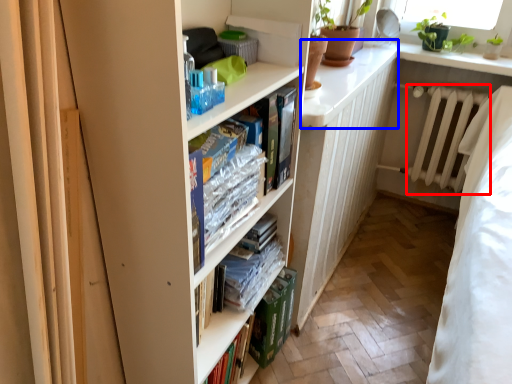
Question: Among these objects, which one is farthest to the camera, radiator (highlighted by a red box) or counter top (highlighted by a blue box)?

Choices:
 (A) radiator
 (B) counter top

Answer: (A)